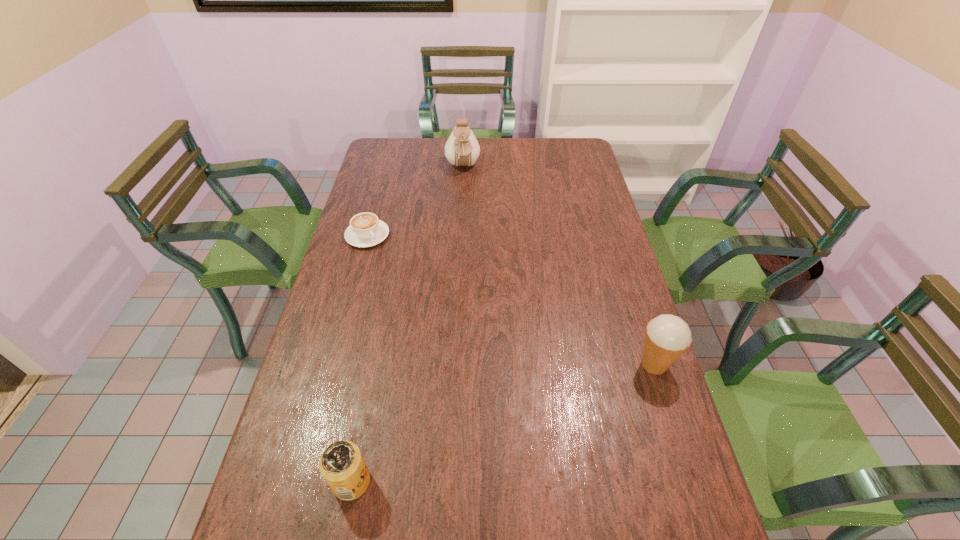
Identify the location of vacant area situated 0.290m on the front-facing side of the farthest object. (467, 224).

I want to click on vacant region located 0.080m on the front-facing side of the farthest object, so click(x=464, y=190).

Locate an element on the screen. vacant space positioned 0.150m on the front-facing side of the farthest object is located at coordinates (465, 201).

The height and width of the screenshot is (540, 960). What are the coordinates of `vacant space located on the side of the cappuccino with the handle` in the screenshot? It's located at (422, 305).

Image resolution: width=960 pixels, height=540 pixels. I want to click on vacant space located 0.240m on the side of the cappuccino with the handle, so click(411, 291).

At what (x,y) coordinates should I click in order to perform the action: click on vacant position located 0.150m on the side of the cappuccino with the handle. Please return your answer as a coordinate pair (x, y). The width and height of the screenshot is (960, 540). Looking at the image, I should click on pos(397,274).

The image size is (960, 540). Find the location of `object that is at the far edge`. object that is at the far edge is located at coordinates (462, 149).

At what (x,y) coordinates should I click in order to perform the action: click on object present at the near edge. Please return your answer as a coordinate pair (x, y). This screenshot has height=540, width=960. Looking at the image, I should click on (342, 465).

The image size is (960, 540). What are the coordinates of `beer can located at the left edge` in the screenshot? It's located at (342, 465).

This screenshot has width=960, height=540. In order to click on cappuccino that is at the left edge in this screenshot , I will do `click(365, 230)`.